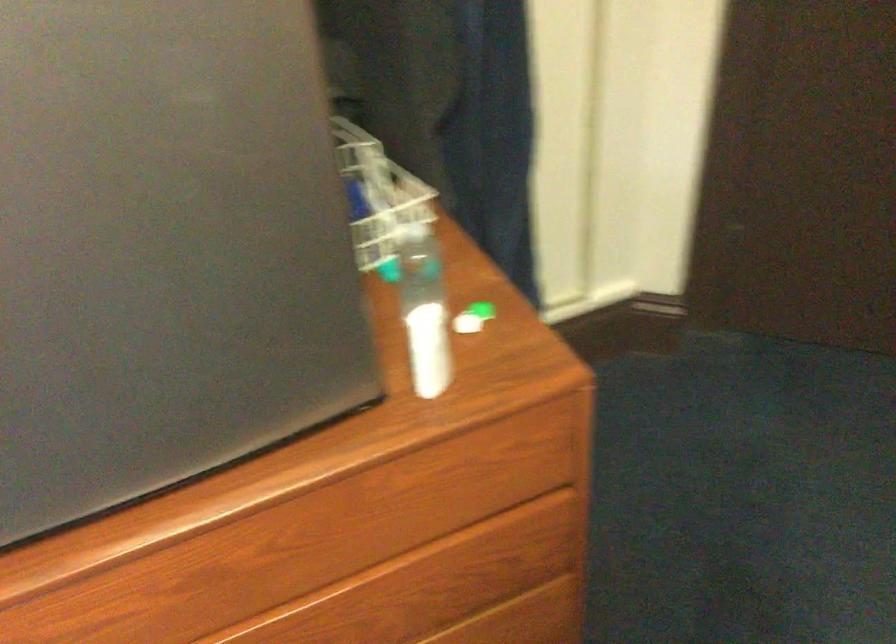
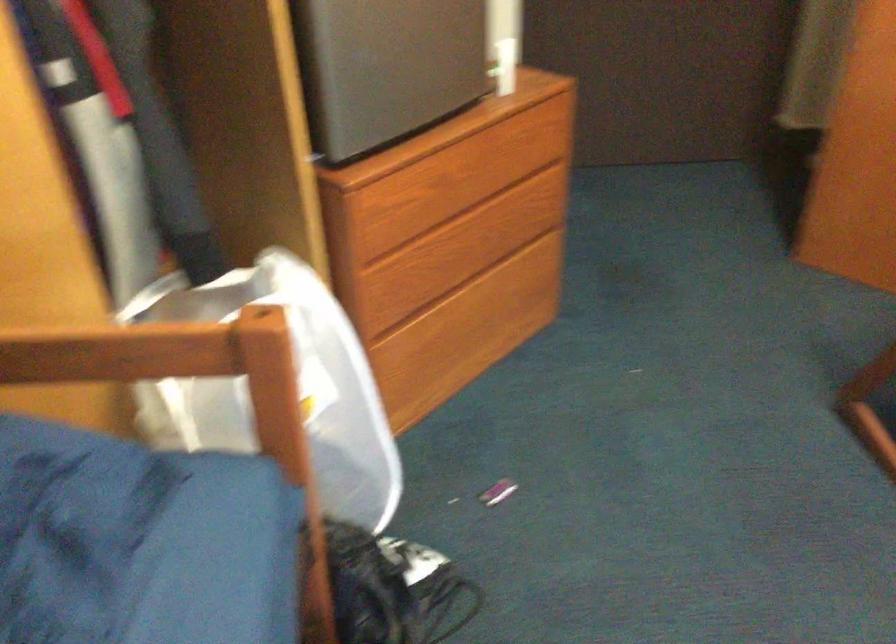
What movement of the cameraman would produce the second image?

The cameraman moved toward left, backward.